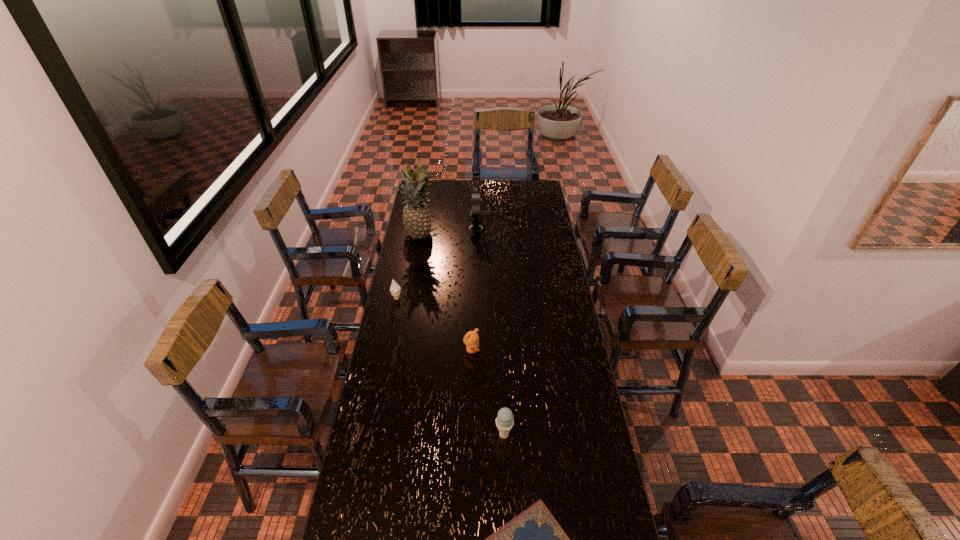
Find the location of a particular element. vacant region between the fourth farthest object and the nearer icecream is located at coordinates (488, 392).

The image size is (960, 540). In order to click on empty space that is in between the fifth shortest object and the third nearest object in this screenshot , I will do `click(474, 289)`.

Locate an element on the screen. This screenshot has width=960, height=540. free spot between the fourth farthest object and the earphone is located at coordinates (474, 289).

Image resolution: width=960 pixels, height=540 pixels. What are the coordinates of `empty location between the tallest object and the earphone` in the screenshot? It's located at (448, 232).

Where is `unoccupied area between the third farthest object and the third tallest object`? unoccupied area between the third farthest object and the third tallest object is located at coordinates (450, 367).

Point out which object is positioned as the fifth nearest to the nearer icecream. Please provide its 2D coordinates. Your answer should be formatted as a tuple, i.e. [(x, y)], where the tuple contains the x and y coordinates of a point satisfying the conditions above.

[(476, 216)]

The image size is (960, 540). Find the location of `object identified as the closest to the shortest object`. object identified as the closest to the shortest object is located at coordinates (504, 421).

Identify the location of vacant region that satisfies the following two spatial constraints: 1. on the face of the third nearest object; 2. on the right side of the taller icecream. (470, 435).

You are a GUI agent. You are given a task and a screenshot of the screen. Output one action in this format:
    pyautogui.click(x=<x>, y=<y>)
    Task: Click on the free space in the image that satisfies the following two spatial constraints: 1. on the ear cups of the second tallest object; 2. on the front-facing side of the farther icecream
    The height and width of the screenshot is (540, 960).
    Given the screenshot: What is the action you would take?
    pyautogui.click(x=475, y=299)

This screenshot has width=960, height=540. What are the coordinates of `free point that satisfies the following two spatial constraints: 1. on the face of the third tallest object; 2. on the left side of the fourth farthest object` in the screenshot? It's located at (470, 435).